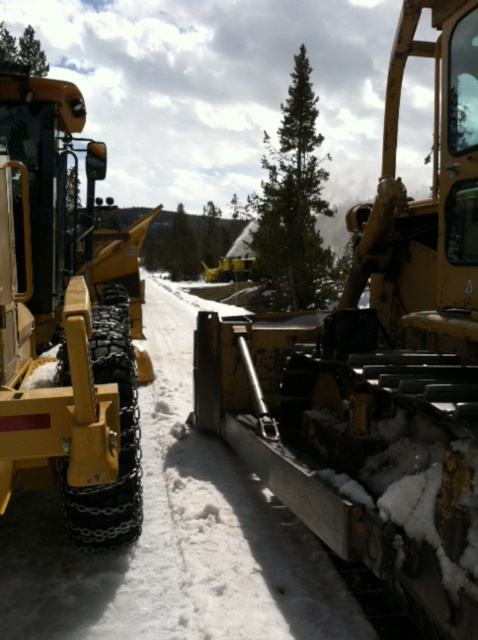
Question: Which object is positioned closest to the matte yellow tractor at center?

Choices:
 (A) green textured pine at center
 (B) yellow rubber tractor at left

Answer: (B)

Question: Can you confirm if matte yellow tractor at center is smaller than yellow rubber tractor at left?

Choices:
 (A) yes
 (B) no

Answer: (B)

Question: Which point is farther to the camera?

Choices:
 (A) (202, 385)
 (B) (321, 240)
 (C) (69, 467)

Answer: (B)

Question: Which object is closer to the camera taking this photo?

Choices:
 (A) green textured pine at center
 (B) yellow rubber tractor at left
 (C) matte yellow tractor at center

Answer: (C)

Question: Does yellow rubber tractor at left appear on the left side of green textured pine at center?

Choices:
 (A) yes
 (B) no

Answer: (A)

Question: Can you confirm if matte yellow tractor at center is bigger than green textured pine at center?

Choices:
 (A) no
 (B) yes

Answer: (A)